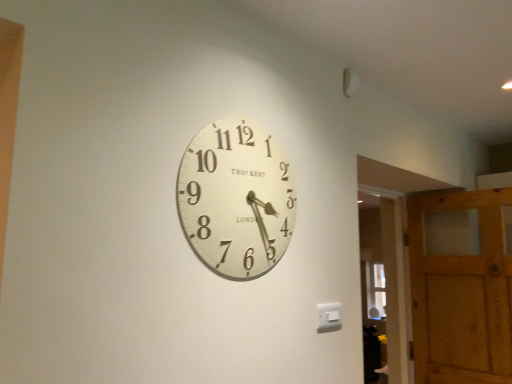
Question: From the image's perspective, is wooden barn door at right located above or below white matte clock at center?

Choices:
 (A) above
 (B) below

Answer: (B)

Question: From a real-world perspective, is wooden barn door at right physically located above or below white matte clock at center?

Choices:
 (A) above
 (B) below

Answer: (B)

Question: Which object is the closest to the wooden barn door at right?

Choices:
 (A) transparent glass door at right
 (B) white matte clock at center

Answer: (A)

Question: Which is farther from the wooden barn door at right?

Choices:
 (A) white matte clock at center
 (B) transparent glass door at right

Answer: (A)